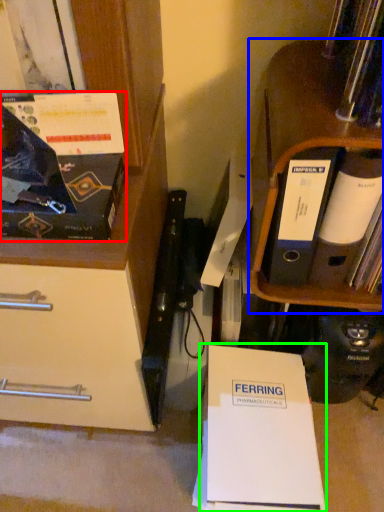
Question: Based on their relative distances, which object is nearer to magazine (highlighted by a red box)? Choose from shelf (highlighted by a blue box) and paperback book (highlighted by a green box).

Choices:
 (A) shelf
 (B) paperback book

Answer: (A)